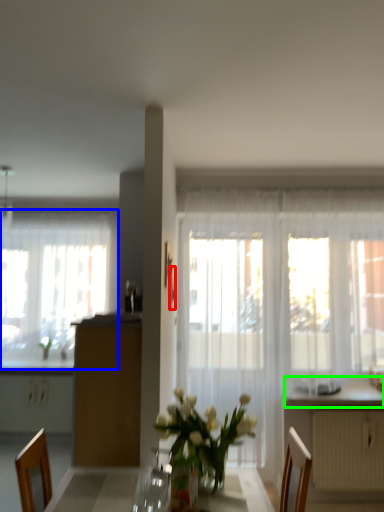
Question: Which object is positioned farthest from picture frame (highlighted by a red box)? Select from window (highlighted by a blue box) and counter top (highlighted by a green box).

Choices:
 (A) window
 (B) counter top

Answer: (A)